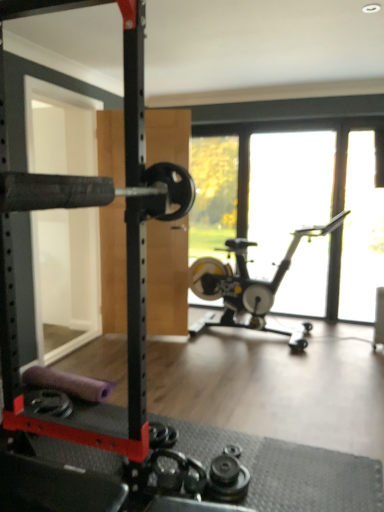
Question: Is point (64, 212) positioned closer to the camera than point (205, 286)?

Choices:
 (A) farther
 (B) closer

Answer: (B)

Question: Is black rubber barbell at left inside or outside of silver metallic stationary bicycle at center?

Choices:
 (A) outside
 (B) inside

Answer: (A)

Question: Which is nearer to the black rubber barbell at left?

Choices:
 (A) transparent glass window screen at right
 (B) transparent glass window at center
 (C) silver metallic stationary bicycle at center

Answer: (C)

Question: Estimate the real-world distances between objects in this image. Which object is closer to the transparent glass window at center?

Choices:
 (A) silver metallic stationary bicycle at center
 (B) black rubber barbell at left
 (C) transparent glass window screen at right

Answer: (C)